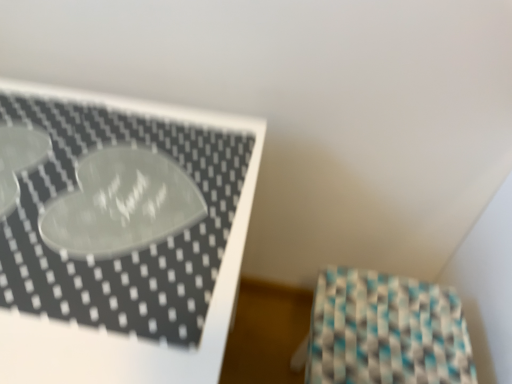
The width and height of the screenshot is (512, 384). What do you see at coordinates (128, 254) in the screenshot?
I see `white glossy tray at upper left` at bounding box center [128, 254].

The image size is (512, 384). Identify the location of white glossy tray at upper left. (128, 254).

Image resolution: width=512 pixels, height=384 pixels. In order to click on teal-patterned fabric at lower right in this screenshot , I will do `click(386, 331)`.

Describe the element at coordinates (386, 331) in the screenshot. I see `teal-patterned fabric at lower right` at that location.

This screenshot has height=384, width=512. What are the coordinates of `white glossy tray at upper left` in the screenshot? It's located at (128, 254).

Can you confirm if white glossy tray at upper left is positioned to the right of teal-patterned fabric at lower right?

No, white glossy tray at upper left is not to the right of teal-patterned fabric at lower right.

Which is in front, white glossy tray at upper left or teal-patterned fabric at lower right?

white glossy tray at upper left is in front.

Which is more distant, (24,107) or (361,291)?

The point (361,291) is farther.

From the image's perspective, which one is positioned lower, white glossy tray at upper left or teal-patterned fabric at lower right?

teal-patterned fabric at lower right is shown below in the image.

From the picture: From a real-world perspective, which object stands above the other?

From a 3D spatial view, white glossy tray at upper left is above.

Does white glossy tray at upper left have a greater width compared to teal-patterned fabric at lower right?

Yes.

Considering the relative sizes of white glossy tray at upper left and teal-patterned fabric at lower right in the image provided, is white glossy tray at upper left shorter than teal-patterned fabric at lower right?

In fact, white glossy tray at upper left may be taller than teal-patterned fabric at lower right.

Can you confirm if white glossy tray at upper left is smaller than teal-patterned fabric at lower right?

Actually, white glossy tray at upper left might be larger than teal-patterned fabric at lower right.

Can we say white glossy tray at upper left lies outside teal-patterned fabric at lower right?

white glossy tray at upper left is positioned outside teal-patterned fabric at lower right.

Would you consider white glossy tray at upper left to be distant from teal-patterned fabric at lower right?

No, there isn't a large distance between white glossy tray at upper left and teal-patterned fabric at lower right.

Does white glossy tray at upper left turn towards teal-patterned fabric at lower right?

No.

Can you tell me how much white glossy tray at upper left and teal-patterned fabric at lower right differ in facing direction?

The angular difference between white glossy tray at upper left and teal-patterned fabric at lower right is 93.1 degrees.

Where is `furniture located in front of the teal-patterned fabric at lower right`? The image size is (512, 384). furniture located in front of the teal-patterned fabric at lower right is located at coordinates click(128, 254).

Considering the positions of objects teal-patterned fabric at lower right and white glossy tray at upper left in the image provided, who is more to the left, teal-patterned fabric at lower right or white glossy tray at upper left?

Positioned to the left is white glossy tray at upper left.

Is teal-patterned fabric at lower right in front of or behind white glossy tray at upper left in the image?

In the image, teal-patterned fabric at lower right appears behind white glossy tray at upper left.

Looking at this image, which point is more forward, (373,330) or (200,297)?

Point (200,297)

From the image's perspective, is teal-patterned fabric at lower right under white glossy tray at upper left?

Indeed, from the image's perspective, teal-patterned fabric at lower right is shown beneath white glossy tray at upper left.

From a real-world perspective, which is physically below, teal-patterned fabric at lower right or white glossy tray at upper left?

In real-world perspective, teal-patterned fabric at lower right is lower.

Considering the sizes of objects teal-patterned fabric at lower right and white glossy tray at upper left in the image provided, who is wider, teal-patterned fabric at lower right or white glossy tray at upper left?

white glossy tray at upper left is wider.

Which of these two, teal-patterned fabric at lower right or white glossy tray at upper left, stands taller?

white glossy tray at upper left.

Considering the sizes of objects teal-patterned fabric at lower right and white glossy tray at upper left in the image provided, who is bigger, teal-patterned fabric at lower right or white glossy tray at upper left?

white glossy tray at upper left is bigger.

Could white glossy tray at upper left be considered to be inside teal-patterned fabric at lower right?

That's incorrect, white glossy tray at upper left is not inside teal-patterned fabric at lower right.

Is teal-patterned fabric at lower right next to white glossy tray at upper left and touching it?

teal-patterned fabric at lower right and white glossy tray at upper left are clearly separated.

Is teal-patterned fabric at lower right oriented towards white glossy tray at upper left?

Yes, teal-patterned fabric at lower right faces towards white glossy tray at upper left.

How different are the orientations of teal-patterned fabric at lower right and white glossy tray at upper left in degrees?

The angular difference between teal-patterned fabric at lower right and white glossy tray at upper left is 93.1 degrees.

Locate an element on the screen. The width and height of the screenshot is (512, 384). furniture above the teal-patterned fabric at lower right (from the image's perspective) is located at coordinates click(128, 254).

At what (x,y) coordinates should I click in order to perform the action: click on furniture that is on the left side of teal-patterned fabric at lower right. Please return your answer as a coordinate pair (x, y). Looking at the image, I should click on (128, 254).

Where is `wrapping paper on the right of white glossy tray at upper left`? Image resolution: width=512 pixels, height=384 pixels. wrapping paper on the right of white glossy tray at upper left is located at coordinates (386, 331).